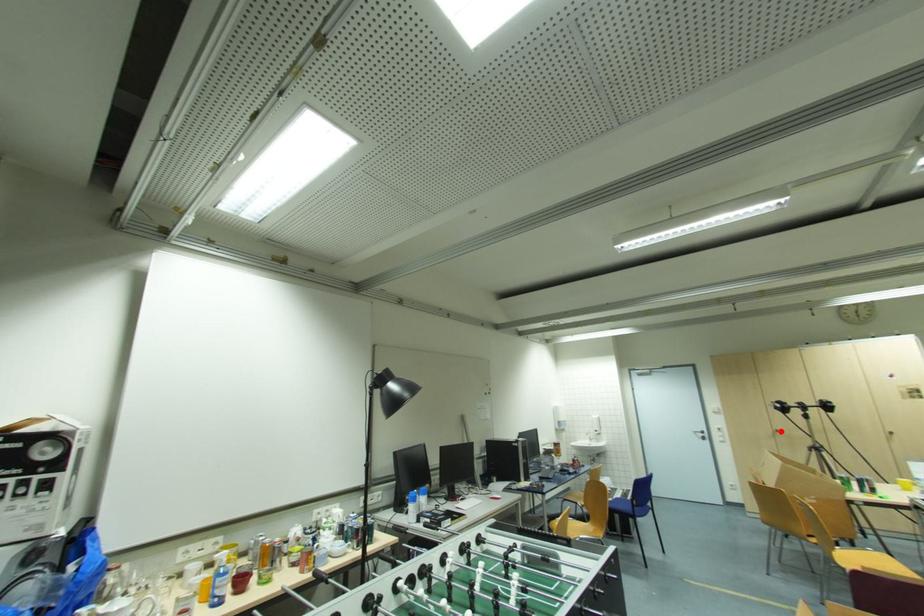
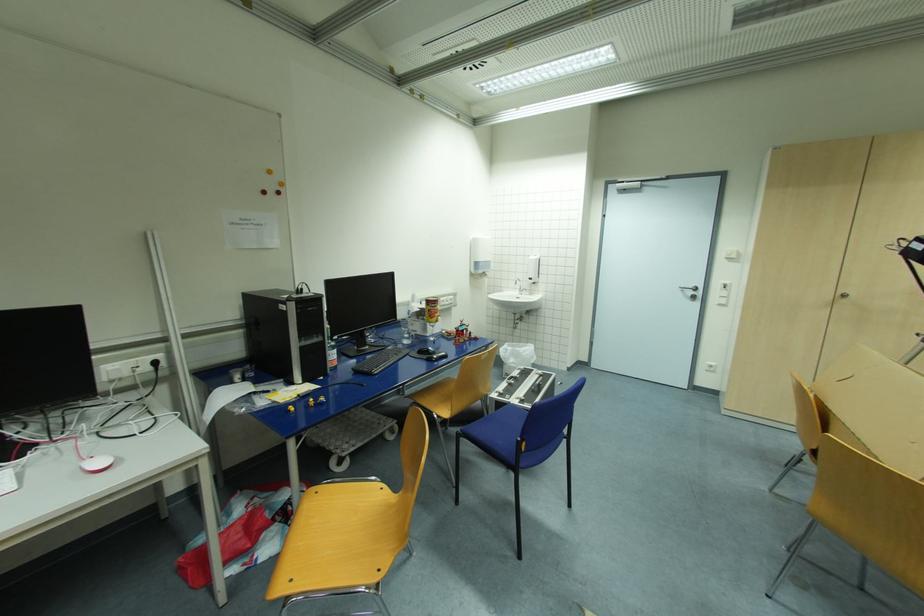
Find the pixel in the second image that matches the highlighted location in the first image.

(847, 296)